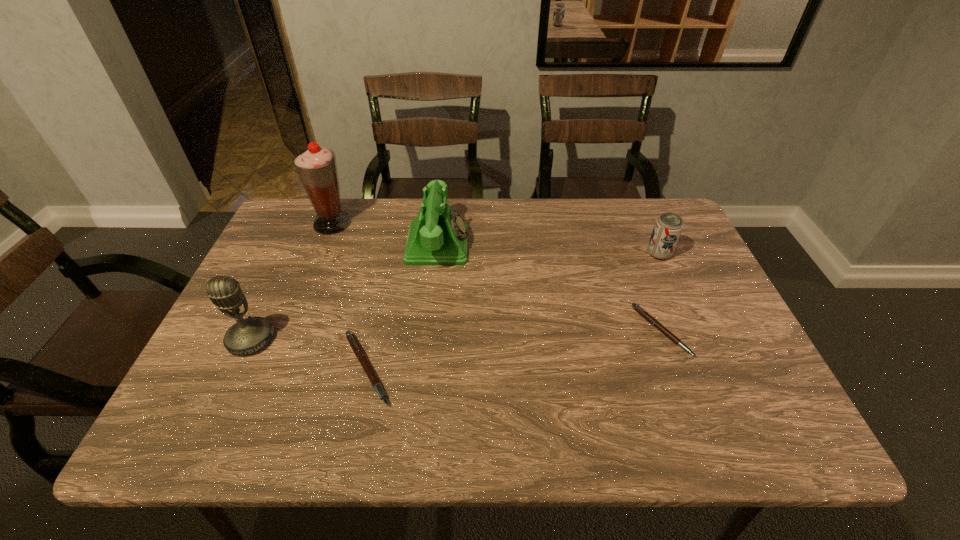
Find the location of a particular element. The image size is (960, 540). the left pen is located at coordinates (358, 351).

Image resolution: width=960 pixels, height=540 pixels. What are the coordinates of `the second shortest object` in the screenshot? It's located at (358, 351).

Where is `the shortest object`? This screenshot has width=960, height=540. the shortest object is located at coordinates (637, 308).

Locate an element on the screen. the shorter pen is located at coordinates (637, 308).

At what (x,y) coordinates should I click in order to perform the action: click on smoothie. Please return your answer as a coordinate pair (x, y). Looking at the image, I should click on (316, 166).

This screenshot has width=960, height=540. Identify the location of telephone. (437, 236).

I want to click on the third shortest object, so click(668, 227).

Locate an element on the screen. The image size is (960, 540). microphone is located at coordinates (250, 335).

Where is `free space located at the nib of the taller pen`? The width and height of the screenshot is (960, 540). free space located at the nib of the taller pen is located at coordinates (577, 369).

This screenshot has width=960, height=540. What are the coordinates of `vacant space located 0.090m at the nib of the right pen` in the screenshot? It's located at (721, 331).